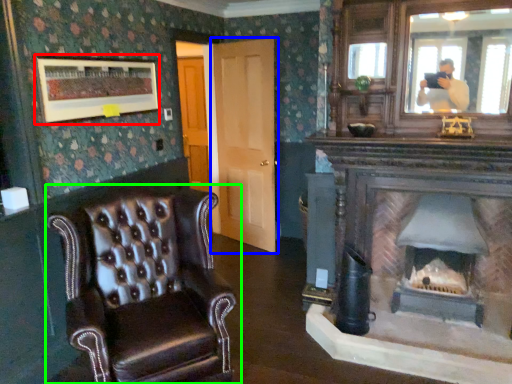
Question: Based on their relative distances, which object is nearer to picture frame (highlighted by a red box)? Choose from door (highlighted by a blue box) and chair (highlighted by a green box).

Choices:
 (A) door
 (B) chair

Answer: (B)